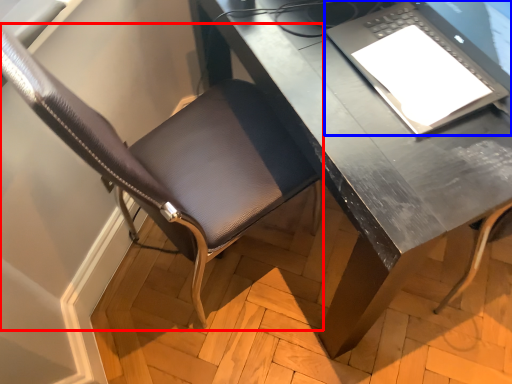
Question: Which of the following is the farthest to the observer, chair (highlighted by a red box) or laptop (highlighted by a blue box)?

Choices:
 (A) chair
 (B) laptop

Answer: (B)